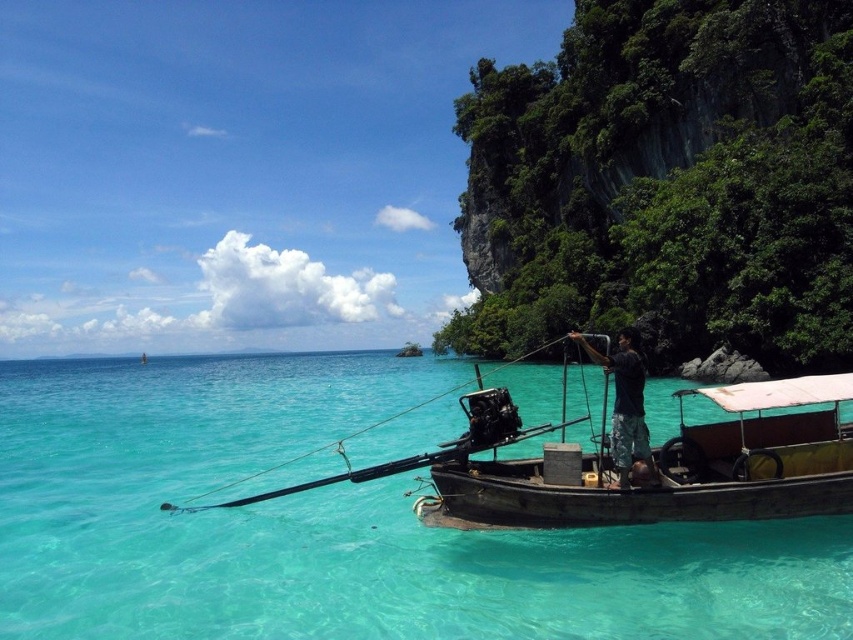
Looking at this image, who is positioned more to the left, clear turquoise water at center or wooden fishing pole at center?

From the viewer's perspective, clear turquoise water at center appears more on the left side.

Based on the photo, is clear turquoise water at center below wooden fishing pole at center?

Yes, clear turquoise water at center is below wooden fishing pole at center.

The width and height of the screenshot is (853, 640). What do you see at coordinates (337, 524) in the screenshot?
I see `clear turquoise water at center` at bounding box center [337, 524].

Locate an element on the screen. clear turquoise water at center is located at coordinates (337, 524).

Consider the image. Is wooden boat at lower right taller than wooden fishing pole at center?

No.

Based on the photo, between wooden boat at lower right and wooden fishing pole at center, which one has more height?

With more height is wooden fishing pole at center.

The width and height of the screenshot is (853, 640). I want to click on wooden boat at lower right, so pyautogui.click(x=675, y=468).

You are a GUI agent. You are given a task and a screenshot of the screen. Output one action in this format:
    pyautogui.click(x=<x>, y=<y>)
    Task: Click on the wooden boat at lower right
    
    Given the screenshot: What is the action you would take?
    pyautogui.click(x=675, y=468)

Who is positioned more to the left, clear turquoise water at center or wooden boat at lower right?

clear turquoise water at center is more to the left.

Is clear turquoise water at center to the left of wooden boat at lower right from the viewer's perspective?

Yes, clear turquoise water at center is to the left of wooden boat at lower right.

Which is behind, point (48, 624) or point (833, 512)?

The point (833, 512) is more distant.

In order to click on clear turquoise water at center in this screenshot , I will do `click(337, 524)`.